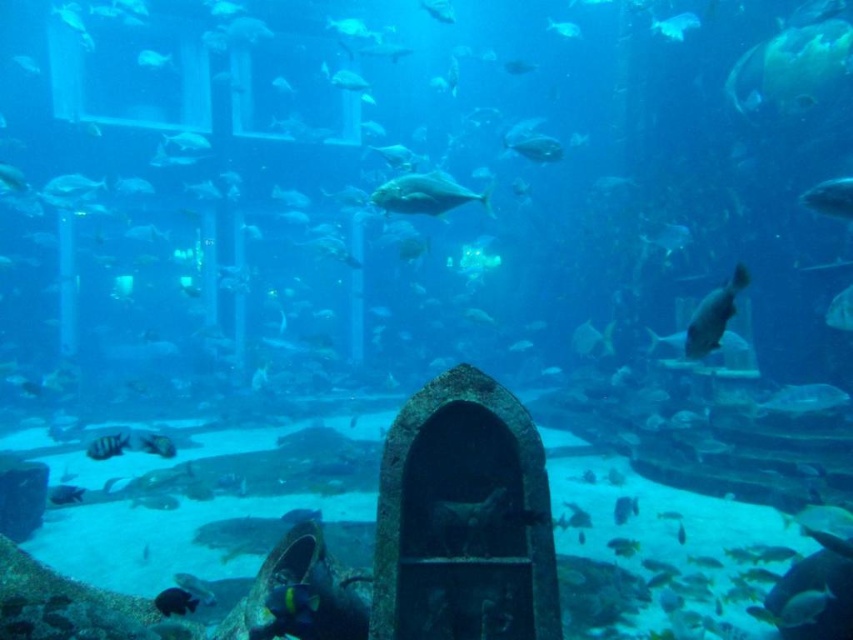
You are an underwater photographer aiming to capture both the shiny silver fish at upper right and the shiny black fish at lower left in a single frame. Based on their positions, which fish is positioned higher in the water column?

The shiny silver fish at upper right is positioned higher in the water column than the shiny black fish at lower left.

You are an underwater photographer aiming to capture a clear shot of the shiny silver fish at right and the shiny black fish at lower left. Which fish will appear closer to the camera lens in your photograph?

The shiny silver fish at right will appear closer to the camera lens because it is positioned in front of the shiny black fish at lower left.

You are a marine biologist observing the aquarium. You notice the shiny silver fish at right and the shiny black fish at lower left. Which fish has a narrower body?

The shiny silver fish at right is thinner than the shiny black fish at lower left, so it has a narrower body.